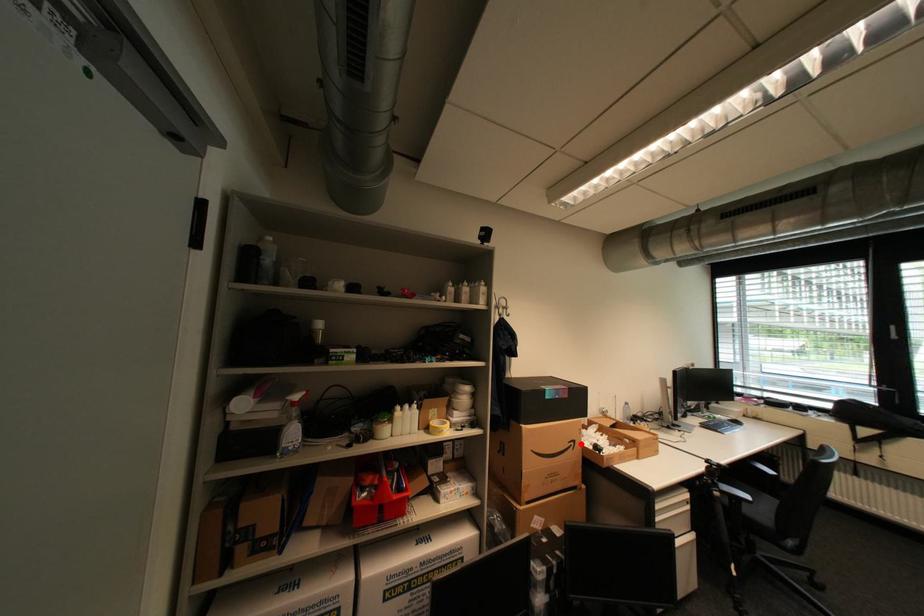
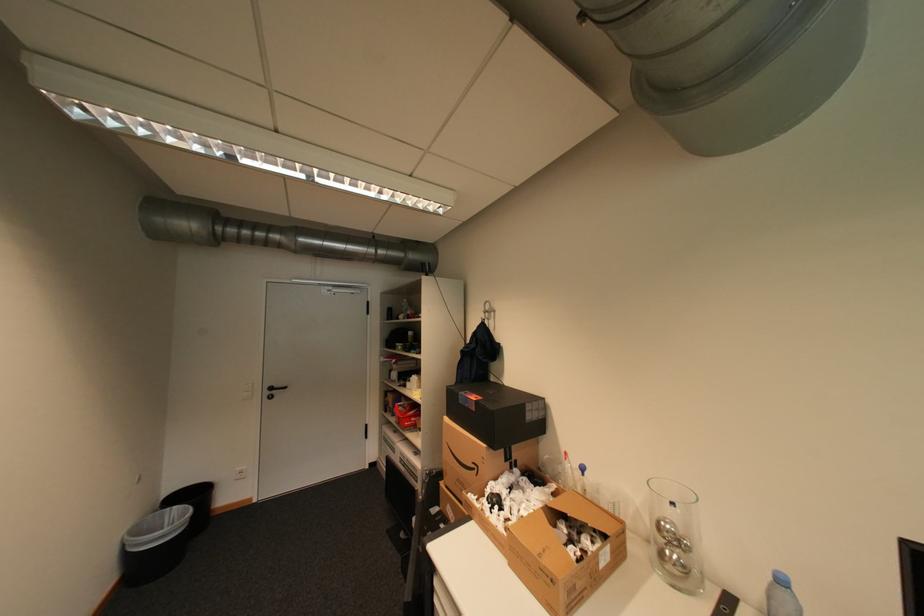
The point at the highlighted location is marked in the first image. Where is the corresponding point in the second image?

(484, 468)